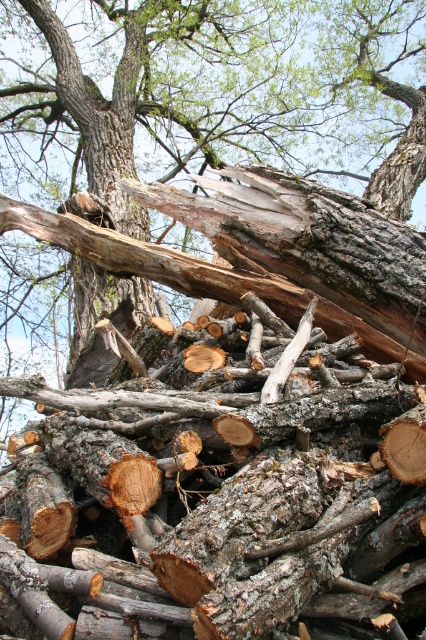
Who is positioned more to the right, gray bark tree trunk at center or gray rough bark tree trunk at upper center?

gray bark tree trunk at center is more to the right.

At what (x,y) coordinates should I click in order to perform the action: click on gray bark tree trunk at center. Please return your answer as a coordinate pair (x, y). Looking at the image, I should click on (230, 125).